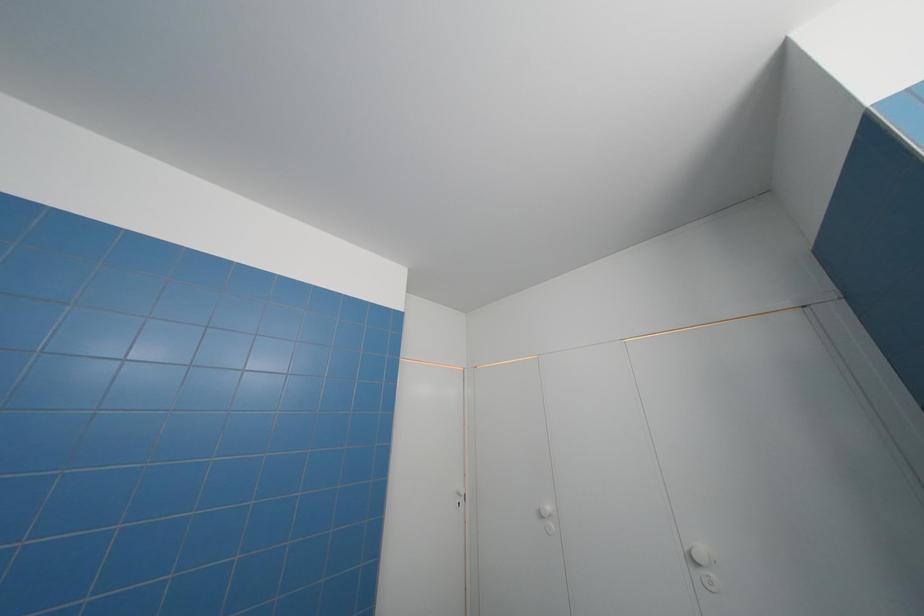
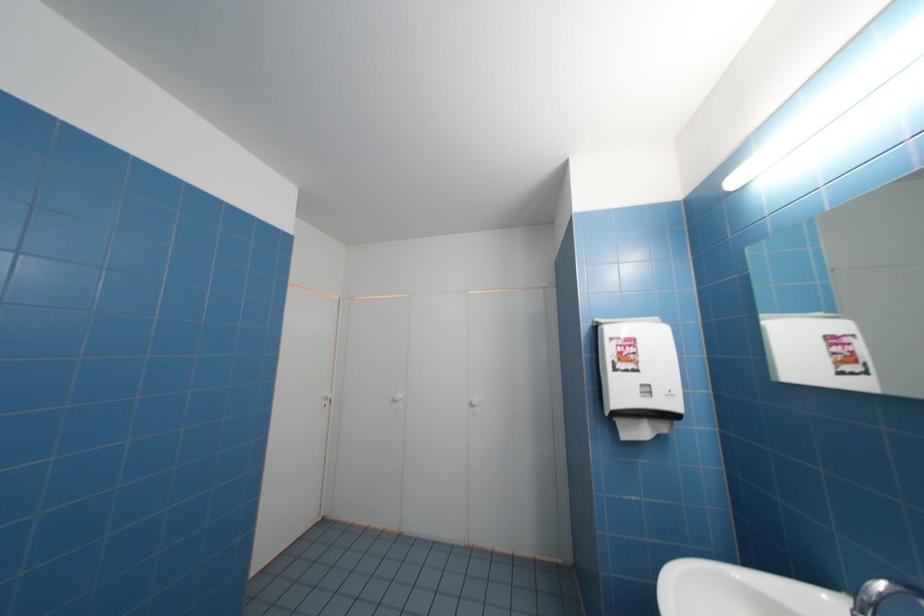
Question: The camera is either moving clockwise (left) or counter-clockwise (right) around the object. The first image is from the beginning of the video and the second image is from the end. Is the camera moving left or right when shooting the video?

Choices:
 (A) Left
 (B) Right

Answer: (A)